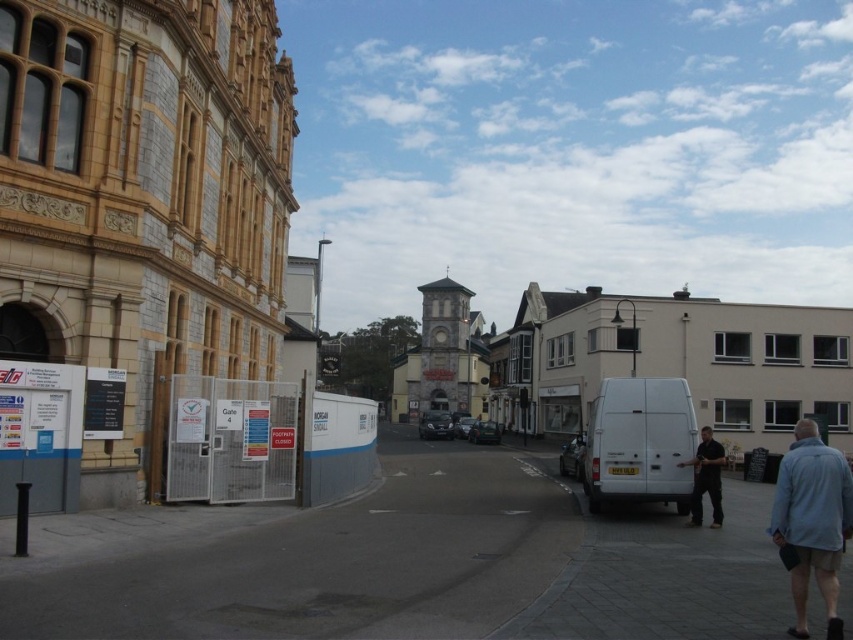
This screenshot has width=853, height=640. What do you see at coordinates (639, 442) in the screenshot?
I see `white matte van at center` at bounding box center [639, 442].

Does point (633, 492) come behind point (833, 548)?

Yes, it is.

Image resolution: width=853 pixels, height=640 pixels. Find the location of `white matte van at center`. white matte van at center is located at coordinates 639,442.

Between white matte van at center and black shirt at center, which one has more height?

white matte van at center

Which is behind, point (621, 419) or point (695, 524)?

Point (621, 419)

I want to click on white matte van at center, so click(639, 442).

Is blue denim jacket at lower right above black shirt at center?

Actually, blue denim jacket at lower right is below black shirt at center.

Can you confirm if blue denim jacket at lower right is smaller than black shirt at center?

Incorrect, blue denim jacket at lower right is not smaller in size than black shirt at center.

Does point (799, 624) come behind point (723, 461)?

No, (799, 624) is closer to viewer.

The height and width of the screenshot is (640, 853). I want to click on blue denim jacket at lower right, so click(x=811, y=520).